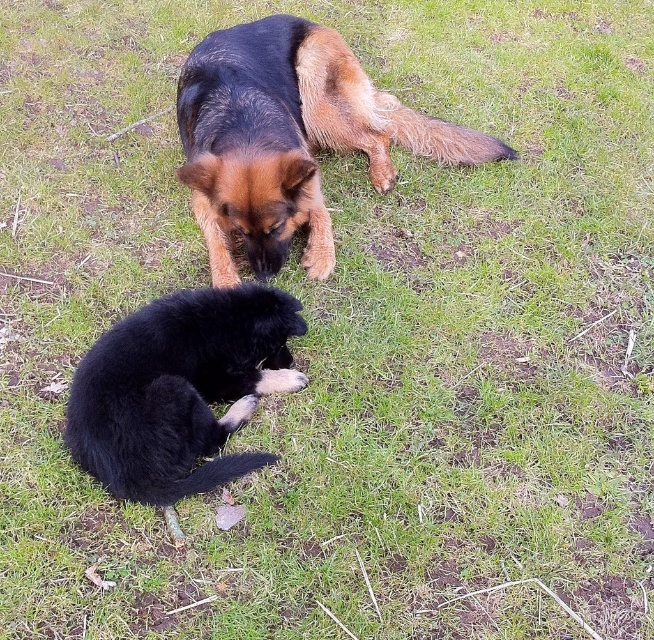
You are a photographer trying to capture a photo of the brown dog in the image. The camera is set up at the origin point, which is at the bottom left corner of the image. The coordinate system uses the bottom left corner as the origin, with the x and y axes increasing to the right and up respectively. Given that the point at coordinates point(288, 138) marks the location of the brown dog, can you determine whether the brown dog is closer to the left or right side of the image?

The point at coordinates point(288, 138) indicates the brown dog is closer to the left side of the image since the x coordinate is 0.217, which is less than 0.5, meaning it is less than halfway from the left edge.